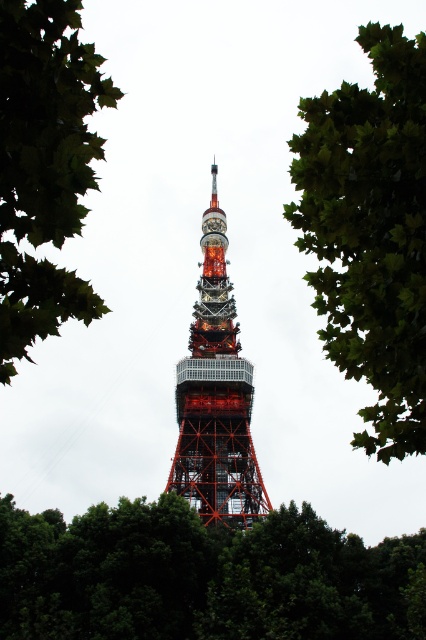
Question: Is green leafy tree at upper center above shiny metallic tower at center?

Choices:
 (A) no
 (B) yes

Answer: (B)

Question: Estimate the real-world distances between objects in this image. Which object is closer to the shiny metallic tower at center?

Choices:
 (A) green leafy tree at upper left
 (B) green leafy tree at center
 (C) green leafy tree at upper center

Answer: (B)

Question: Can you confirm if green leafy tree at center is bigger than green leafy tree at upper left?

Choices:
 (A) yes
 (B) no

Answer: (A)

Question: Estimate the real-world distances between objects in this image. Which object is farther from the green leafy tree at upper center?

Choices:
 (A) green leafy tree at upper left
 (B) shiny metallic tower at center
 (C) green leafy tree at center

Answer: (B)

Question: Is green leafy tree at upper center positioned behind green leafy tree at upper left?

Choices:
 (A) yes
 (B) no

Answer: (A)

Question: Which of these objects is positioned farthest from the shiny metallic tower at center?

Choices:
 (A) green leafy tree at center
 (B) green leafy tree at upper center

Answer: (B)